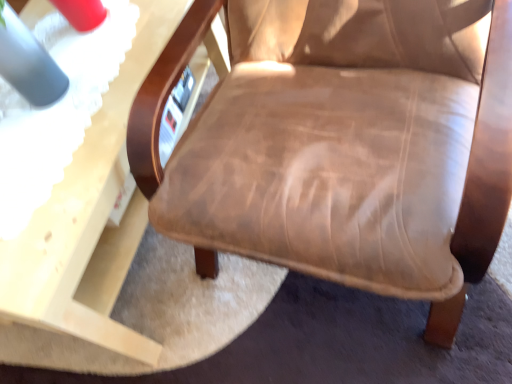
The height and width of the screenshot is (384, 512). I want to click on vacant space situated above matte wood table at lower left (from a real-world perspective), so click(65, 93).